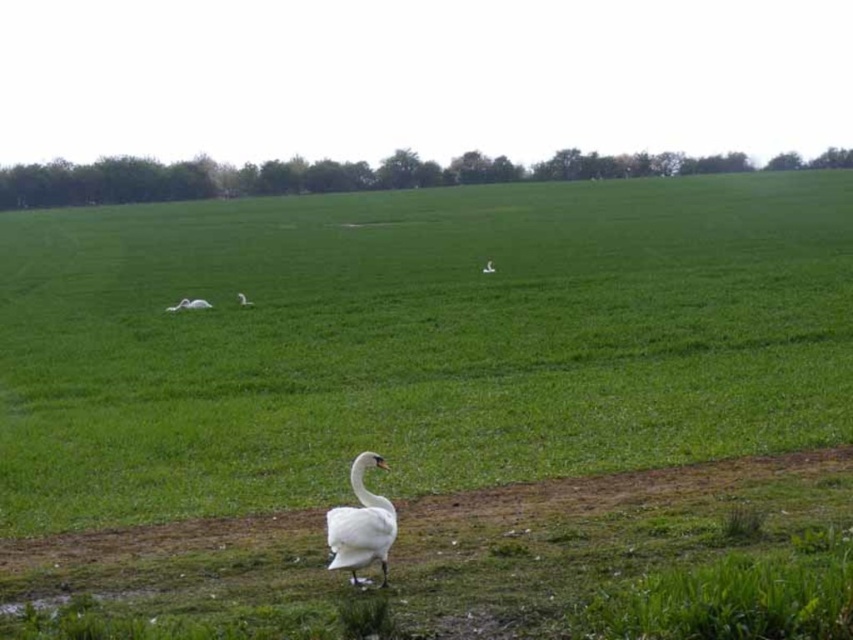
The height and width of the screenshot is (640, 853). What do you see at coordinates (361, 525) in the screenshot?
I see `white glossy swan at center` at bounding box center [361, 525].

Identify the location of white glossy swan at center. This screenshot has width=853, height=640. (361, 525).

Does green grass at center appear on the left side of white matte swan at center?

Correct, you'll find green grass at center to the left of white matte swan at center.

Is point (727, 316) positioned behind point (239, 300)?

No, (727, 316) is in front of (239, 300).

What do you see at coordinates (415, 340) in the screenshot? The height and width of the screenshot is (640, 853). I see `green grass at center` at bounding box center [415, 340].

Locate an element on the screen. The image size is (853, 640). green grass at center is located at coordinates (415, 340).

Is white glossy swan at center positioned at the back of white matte goose at center?

No.

Is white glossy swan at center bigger than white matte goose at center?

Indeed, white glossy swan at center has a larger size compared to white matte goose at center.

Is point (335, 512) positioned behind point (490, 259)?

No, (335, 512) is closer to viewer.

In order to click on white glossy swan at center in this screenshot , I will do `click(361, 525)`.